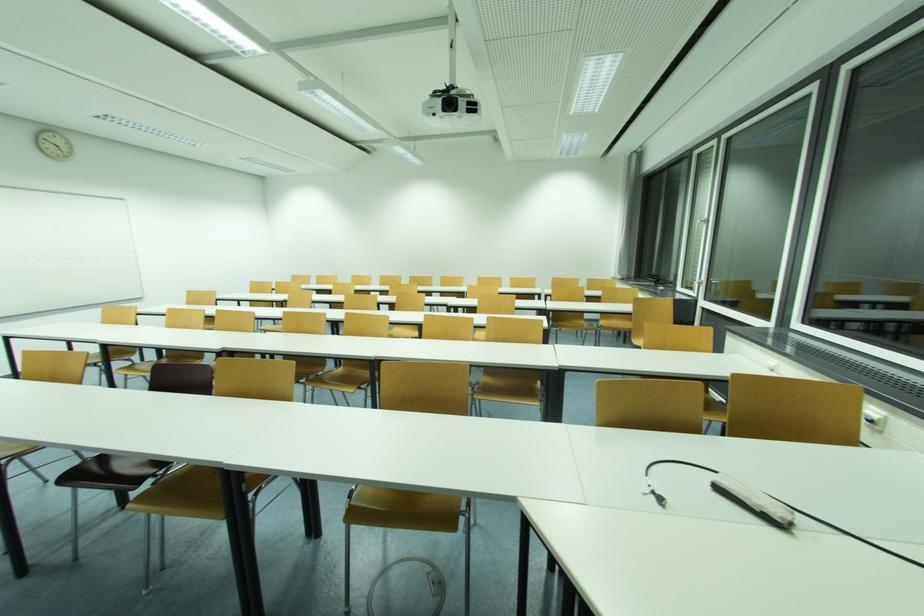
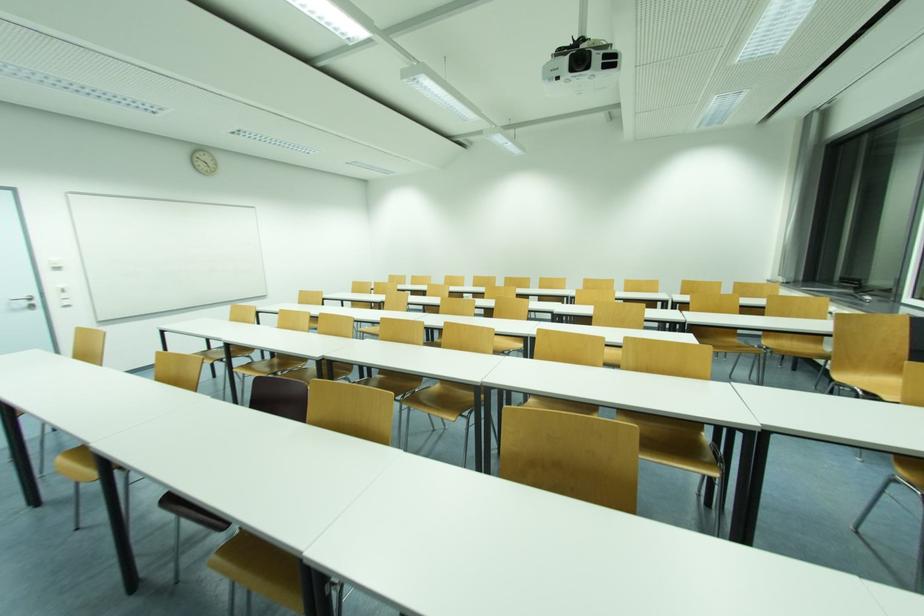
The images are taken continuously from a first-person perspective. In which direction are you moving?

The cameraman moved toward left, forward.